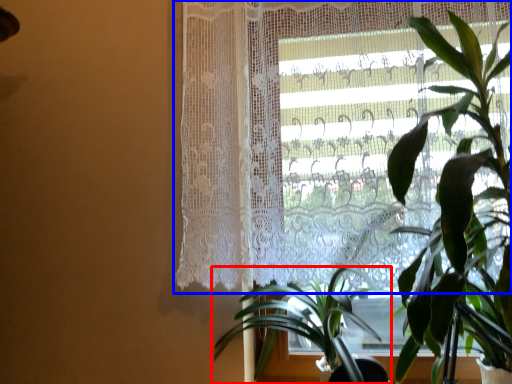
Question: Among these objects, which one is farthest to the camera, houseplant (highlighted by a red box) or curtain (highlighted by a blue box)?

Choices:
 (A) houseplant
 (B) curtain

Answer: (B)